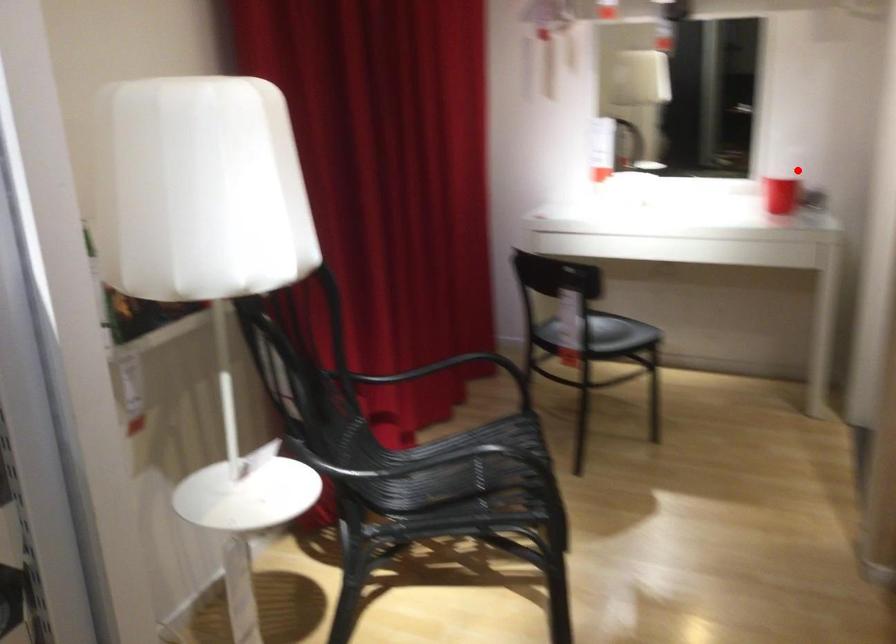
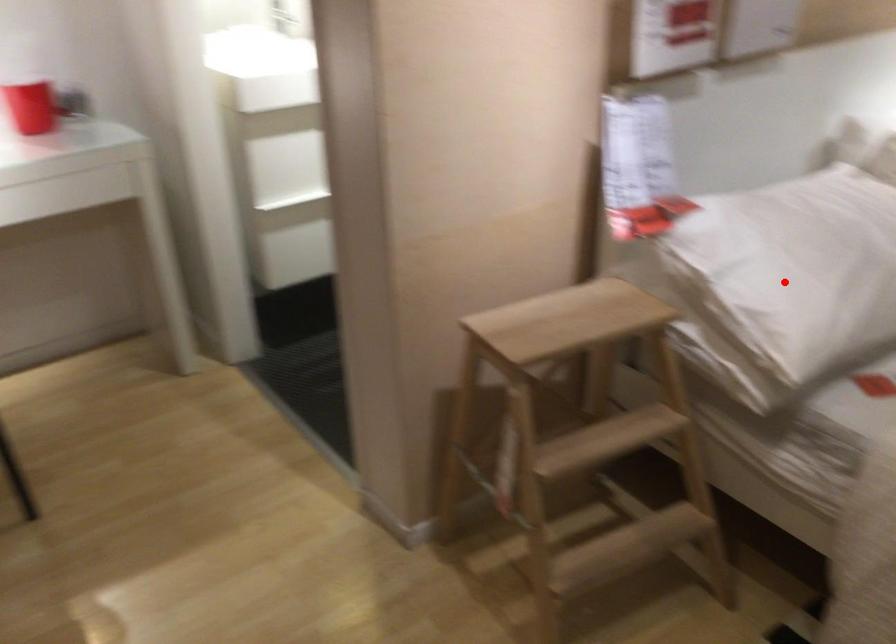
I am providing you with two images of the same scene from different viewpoints. A red point is marked on the first image and another point is marked on the second image. Is the red point in image1 aligned with the point shown in image2?

No